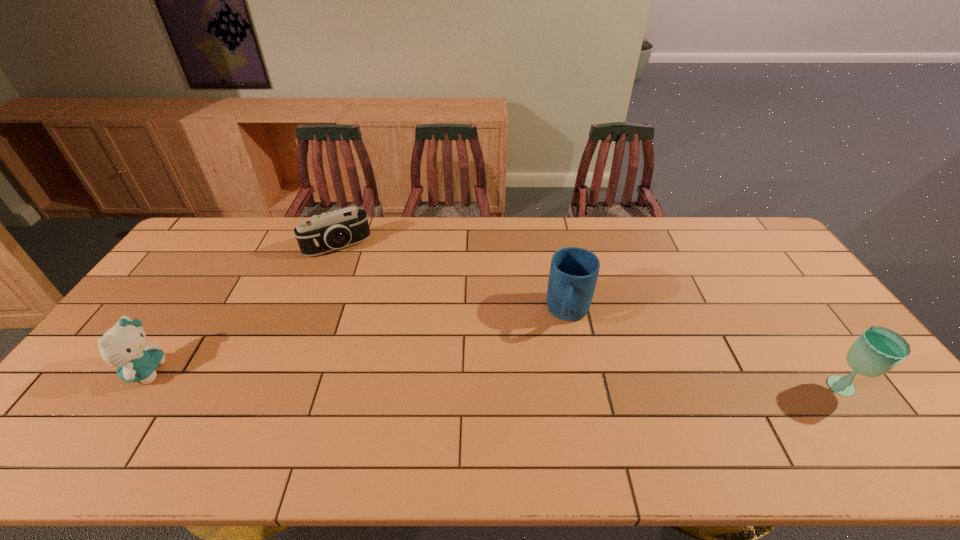
Where is `object situated at the near right corner`? This screenshot has height=540, width=960. object situated at the near right corner is located at coordinates (878, 350).

Locate an element on the screen. The height and width of the screenshot is (540, 960). vacant region at the far edge of the desktop is located at coordinates (242, 258).

In the image, there is a desktop. Where is `vacant region at the near edge`? The image size is (960, 540). vacant region at the near edge is located at coordinates (609, 399).

The image size is (960, 540). I want to click on vacant space at the left edge of the desktop, so click(x=174, y=332).

Where is `vacant space at the right edge of the desktop`? The image size is (960, 540). vacant space at the right edge of the desktop is located at coordinates (787, 302).

The image size is (960, 540). In the image, there is a desktop. Identify the location of vacant space at the far right corner. (711, 219).

I want to click on vacant space that's between the second farthest object and the camera, so click(x=453, y=280).

You are a GUI agent. You are given a task and a screenshot of the screen. Output one action in this format:
    pyautogui.click(x=<x>, y=<y>)
    Task: Click on the empty location between the glass and the leftmost object
    The width and height of the screenshot is (960, 540).
    Given the screenshot: What is the action you would take?
    pyautogui.click(x=494, y=380)

Where is `vacant point located between the farthest object and the glass`? Image resolution: width=960 pixels, height=540 pixels. vacant point located between the farthest object and the glass is located at coordinates (590, 318).

Find the location of a particular element. free area in between the third nearest object and the glass is located at coordinates (706, 352).